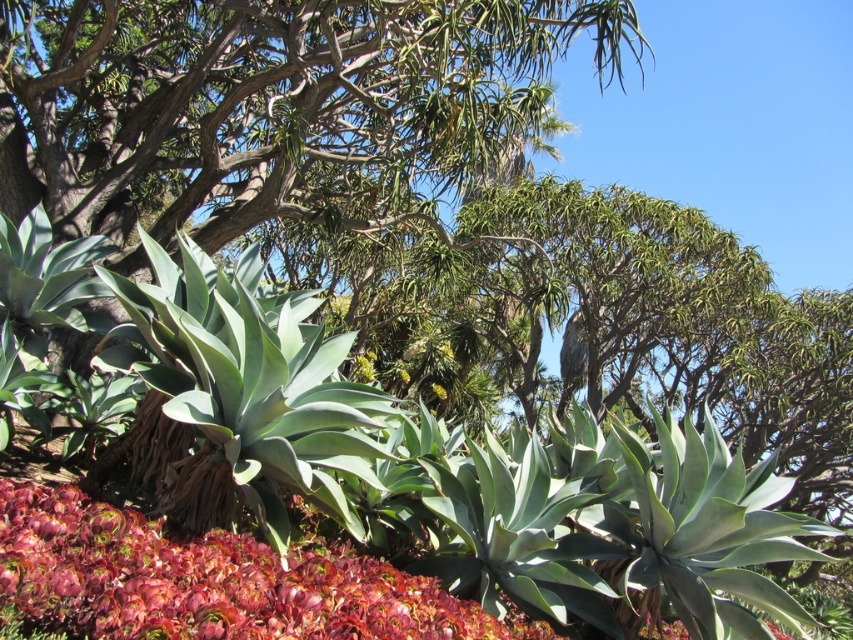
Question: Is green leafy tree at center closer to the viewer compared to smooth red flower at lower left?

Choices:
 (A) yes
 (B) no

Answer: (B)

Question: Which object is closer to the camera taking this photo?

Choices:
 (A) smooth red flower at lower left
 (B) green leafy tree at center

Answer: (A)

Question: Is green leafy tree at center wider than smooth red flower at lower left?

Choices:
 (A) yes
 (B) no

Answer: (B)

Question: Which object is closer to the camera taking this photo?

Choices:
 (A) smooth red flower at lower left
 (B) green leafy tree at center

Answer: (A)

Question: Does green leafy tree at center have a greater width compared to smooth red flower at lower left?

Choices:
 (A) no
 (B) yes

Answer: (A)